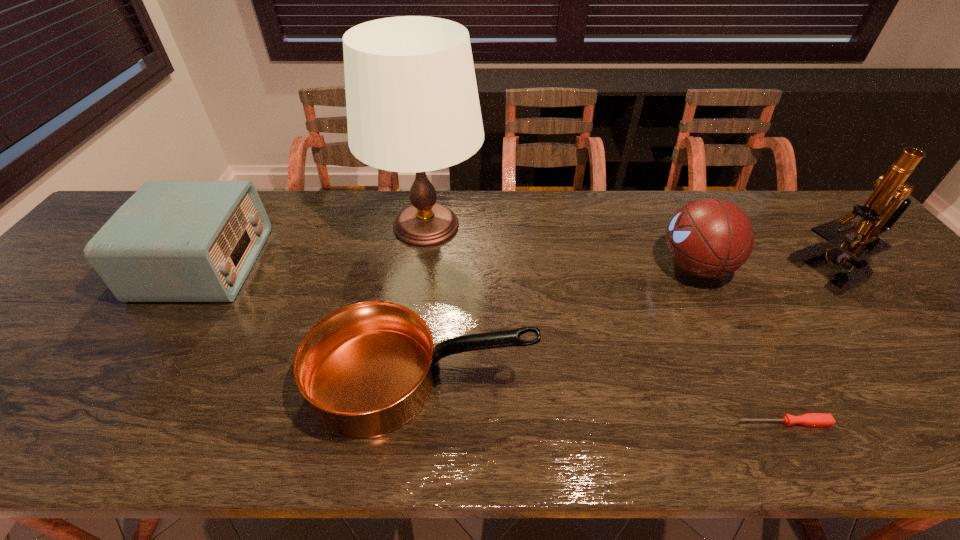
Identify the location of free area in between the shortest object and the frying pan. This screenshot has width=960, height=540. (603, 402).

In order to click on empty location between the frying pan and the basketball in this screenshot , I will do `click(559, 323)`.

You are a GUI agent. You are given a task and a screenshot of the screen. Output one action in this format:
    pyautogui.click(x=<x>, y=<y>)
    Task: Click on the vacant region between the tallest object and the basketball
    This screenshot has height=540, width=960.
    Given the screenshot: What is the action you would take?
    pyautogui.click(x=561, y=246)

In order to click on free space between the screwdriver and the lamp in this screenshot , I will do `click(605, 324)`.

Where is `free spot between the rightmost object and the tallest object`? The height and width of the screenshot is (540, 960). free spot between the rightmost object and the tallest object is located at coordinates (632, 248).

Locate an element on the screen. This screenshot has width=960, height=540. free spot between the microscope and the screwdriver is located at coordinates (810, 347).

Where is `object identified as the second closest to the basketball`? The width and height of the screenshot is (960, 540). object identified as the second closest to the basketball is located at coordinates (809, 419).

This screenshot has height=540, width=960. I want to click on the fifth closest object relative to the frying pan, so [x=887, y=203].